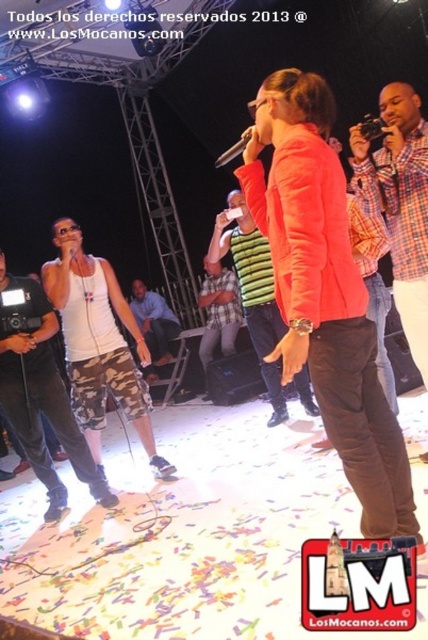
You are a photographer at the event and want to capture a clear shot of both the green striped shirt at center and the metallic silver microphone at center. Considering their sizes, which object should you focus on first to ensure it appears sharp in the photo?

The green striped shirt at center has a smaller size compared to the metallic silver microphone at center, so you should focus on the metallic silver microphone at center first as it is larger and more likely to be in focus if centered properly.

From the picture: Based on the scene description, where is the green striped shirt at center located in terms of coordinates?

The green striped shirt at center is located at coordinates point [219,314].

You are a photographer positioned at the back of the stage. You want to capture a photo of the green striped shirt at center and the metallic silver microphone at center. Which object will appear closer to the camera in the photo?

The green striped shirt at center will appear closer to the camera in the photo because it is positioned further to the viewer than the metallic silver microphone at center.